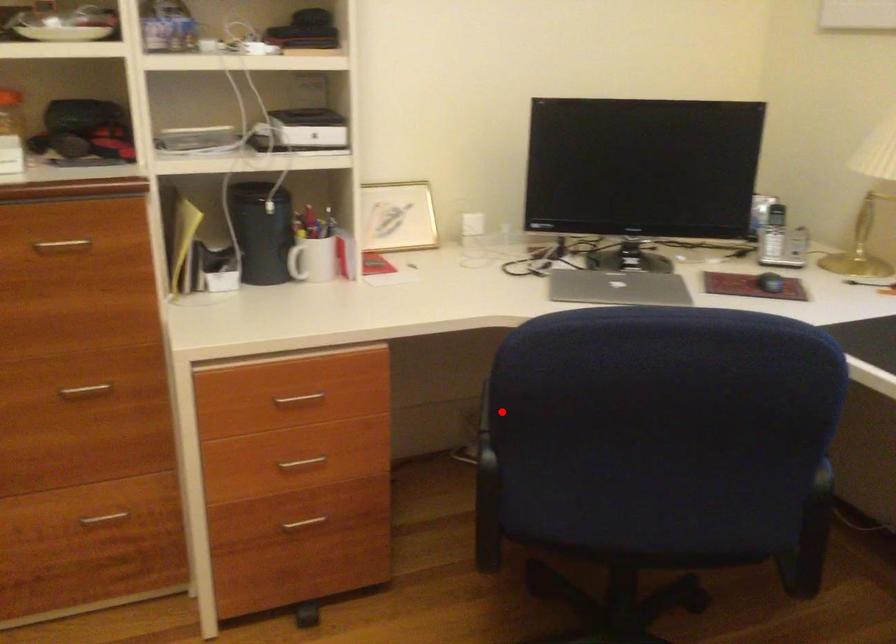
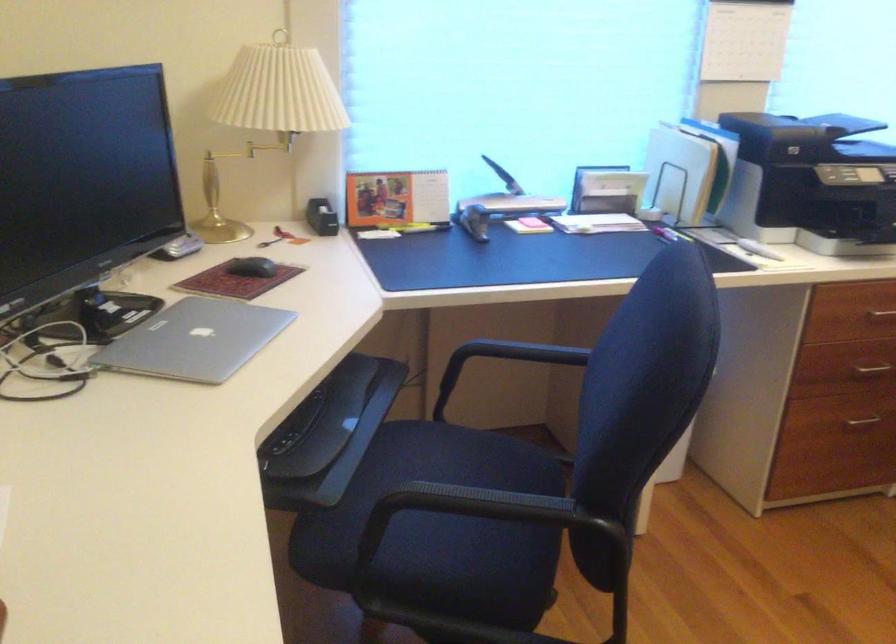
Question: I am providing you with two images of the same scene from different viewpoints. Given a red point in image1, look at the same physical point in image2. Is it:

Choices:
 (A) Closer to the viewpoint
 (B) Farther from the viewpoint

Answer: (A)